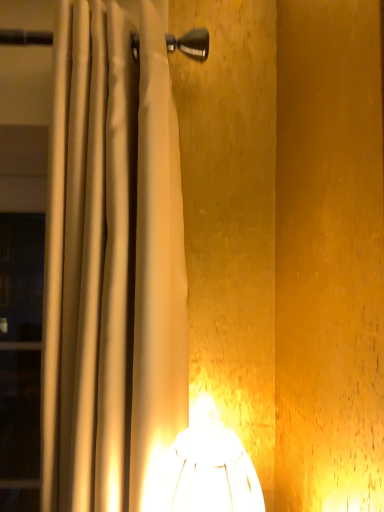
Question: Should I look upward or downward to see white fabric curtain at left?

Choices:
 (A) up
 (B) down

Answer: (B)